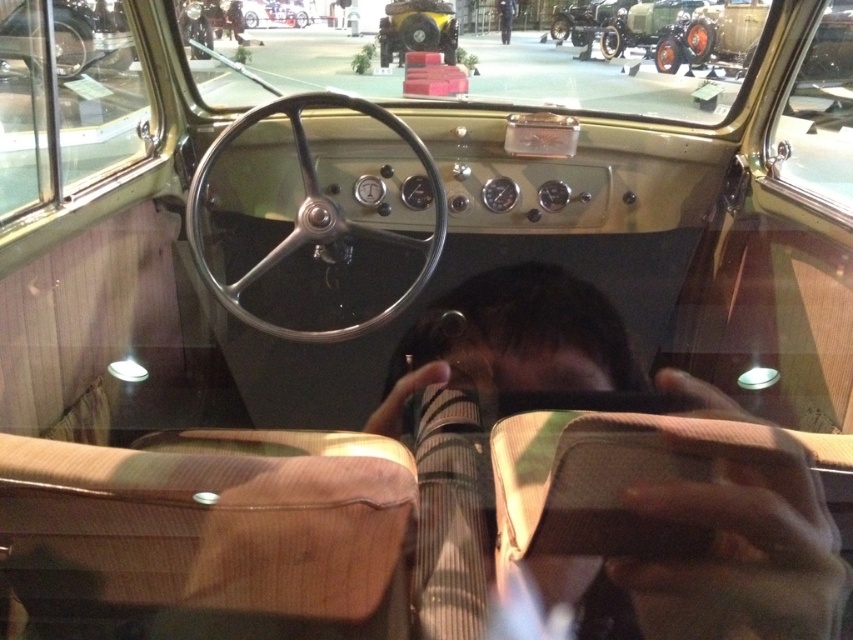
Does dark brown leather jacket at center have a lesser height compared to black fabric pants at center?

Indeed, dark brown leather jacket at center has a lesser height compared to black fabric pants at center.

Does dark brown leather jacket at center have a larger size compared to black fabric pants at center?

Yes, dark brown leather jacket at center is bigger than black fabric pants at center.

Between point (759, 554) and point (505, 22), which one is positioned in front?

Point (759, 554) is in front.

Locate an element on the screen. The image size is (853, 640). dark brown leather jacket at center is located at coordinates (743, 561).